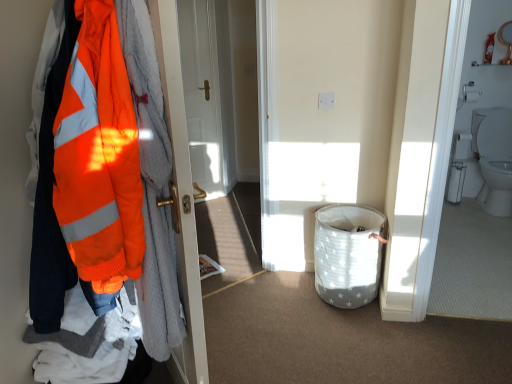
The image size is (512, 384). Identify the location of high-visibility orange jacket at left. point(152,184).

What do you see at coordinates (475, 189) in the screenshot? Image resolution: width=512 pixels, height=384 pixels. I see `white glossy toilet at right` at bounding box center [475, 189].

Measure the distance between point (222, 138) and camera.

Point (222, 138) is 3.82 meters away from camera.

Where is `white fabric laundry basket at lower center`? white fabric laundry basket at lower center is located at coordinates (347, 254).

Does white glossy toilet at right have a greater width compared to high-visibility orange jacket at left?

Yes, white glossy toilet at right is wider than high-visibility orange jacket at left.

Is white glossy toilet at right not within high-visibility orange jacket at left?

white glossy toilet at right is positioned outside high-visibility orange jacket at left.

Is white glossy toilet at right next to high-visibility orange jacket at left and touching it?

No, white glossy toilet at right is not beside high-visibility orange jacket at left.

Locate an element on the screen. Image resolution: width=512 pixels, height=384 pixels. jacket below the white glossy toilet at right (from the image's perspective) is located at coordinates (152, 184).

From a real-world perspective, is white glossy door at center above or below white glossy toilet at right?

white glossy door at center is situated higher than white glossy toilet at right in the real world.

From the image's perspective, which is below, white glossy door at center or white glossy toilet at right?

white glossy toilet at right is shown below in the image.

Is white glossy toilet at right located within white glossy door at center?

No, white glossy toilet at right is not a part of white glossy door at center.

Is white glossy door at center oriented away from white glossy toilet at right?

white glossy door at center does not have its back to white glossy toilet at right.

Is white fabric laundry basket at lower center at the back of white glossy toilet at right?

No, white glossy toilet at right's orientation is not away from white fabric laundry basket at lower center.

Which object is closer to the camera, white glossy toilet at right or white fabric laundry basket at lower center?

Positioned in front is white glossy toilet at right.

How many degrees apart are the facing directions of white glossy toilet at right and white fabric laundry basket at lower center?

The facing directions of white glossy toilet at right and white fabric laundry basket at lower center are 1.29 degrees apart.

Can you confirm if white glossy toilet at right is wider than white fabric laundry basket at lower center?

No.

From the image's perspective, which object appears higher, white fabric laundry basket at lower center or high-visibility orange jacket at left?

high-visibility orange jacket at left, from the image's perspective.

Between white fabric laundry basket at lower center and high-visibility orange jacket at left, which one is positioned behind?

white fabric laundry basket at lower center is further away from the camera.

Measure the distance from white fabric laundry basket at lower center to high-visibility orange jacket at left.

white fabric laundry basket at lower center is 1.24 meters away from high-visibility orange jacket at left.

Is white fabric laundry basket at lower center placed right next to high-visibility orange jacket at left?

No, white fabric laundry basket at lower center is not beside high-visibility orange jacket at left.

In the scene shown: Does white glossy door at center contain high-visibility orange jacket at left?

No, white glossy door at center does not contain high-visibility orange jacket at left.

From a real-world perspective, does white glossy door at center sit lower than high-visibility orange jacket at left?

Correct, in the physical world, white glossy door at center is lower than high-visibility orange jacket at left.

From the picture: Considering the sizes of white glossy door at center and high-visibility orange jacket at left in the image, is white glossy door at center wider or thinner than high-visibility orange jacket at left?

white glossy door at center is thinner than high-visibility orange jacket at left.

Who is bigger, white glossy door at center or high-visibility orange jacket at left?

high-visibility orange jacket at left.

Which is more to the left, white glossy toilet at right or high-visibility orange jacket at left?

From the viewer's perspective, high-visibility orange jacket at left appears more on the left side.

Is high-visibility orange jacket at left a part of white glossy toilet at right?

Definitely not — high-visibility orange jacket at left is not inside white glossy toilet at right.

Is white glossy toilet at right shorter than high-visibility orange jacket at left?

Incorrect, the height of white glossy toilet at right does not fall short of that of high-visibility orange jacket at left.

At what (x,y) coordinates should I click in order to perform the action: click on corridor lying behind the high-visibility orange jacket at left. Please return your answer as a coordinate pair (x, y). Looking at the image, I should click on (475, 189).

From the image's perspective, is white fabric laundry basket at lower center on top of white glossy toilet at right?

No.

Between white fabric laundry basket at lower center and white glossy toilet at right, which one appears on the left side from the viewer's perspective?

white fabric laundry basket at lower center.

Is white fabric laundry basket at lower center facing towards white glossy toilet at right?

No, white fabric laundry basket at lower center is not oriented towards white glossy toilet at right.

Which is correct: white fabric laundry basket at lower center is inside white glossy toilet at right, or outside of it?

white fabric laundry basket at lower center lies outside white glossy toilet at right.

Identify the location of toilet behind the high-visibility orange jacket at left. (494, 157).

I want to click on toilet below the white glossy door at center (from a real-world perspective), so click(494, 157).

Looking at the image, which one is located further to white glossy door at center, white glossy toilet at right or white glossy toilet at right?

Among the two, white glossy toilet at right is located further to white glossy door at center.

From the image, which object appears to be farther from white glossy toilet at right, high-visibility orange jacket at left or white glossy door at center?

high-visibility orange jacket at left.

Based on their spatial positions, is white fabric laundry basket at lower center or white glossy toilet at right further from white glossy toilet at right?

white fabric laundry basket at lower center lies further to white glossy toilet at right than the other object.

When comparing their distances from white glossy toilet at right, does white fabric laundry basket at lower center or white glossy door at center seem further?

The object further to white glossy toilet at right is white glossy door at center.

From the image, which object appears to be farther from white glossy toilet at right, white fabric laundry basket at lower center or high-visibility orange jacket at left?

high-visibility orange jacket at left lies further to white glossy toilet at right than the other object.

Based on their spatial positions, is white glossy toilet at right or high-visibility orange jacket at left closer to white glossy door at center?

The object closer to white glossy door at center is white glossy toilet at right.

Estimate the real-world distances between objects in this image. Which object is closer to white glossy door at center, high-visibility orange jacket at left or white glossy toilet at right?

white glossy toilet at right.

Considering their positions, is white glossy toilet at right positioned closer to white glossy toilet at right than white glossy door at center?

The object closer to white glossy toilet at right is white glossy toilet at right.

The width and height of the screenshot is (512, 384). Identify the location of laundry basket between high-visibility orange jacket at left and white glossy toilet at right from left to right. (347, 254).

Where is `corridor between high-visibility orange jacket at left and white glossy toilet at right in the horizontal direction`? This screenshot has width=512, height=384. corridor between high-visibility orange jacket at left and white glossy toilet at right in the horizontal direction is located at coordinates (475, 189).

Identify the location of corridor between white glossy door at center and white glossy toilet at right in the horizontal direction. pos(475,189).

The width and height of the screenshot is (512, 384). Identify the location of laundry basket between high-visibility orange jacket at left and white glossy toilet at right from left to right. (347, 254).